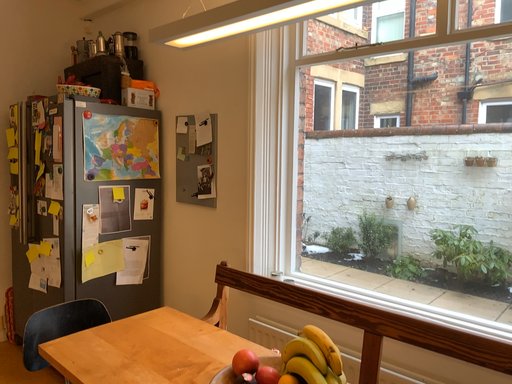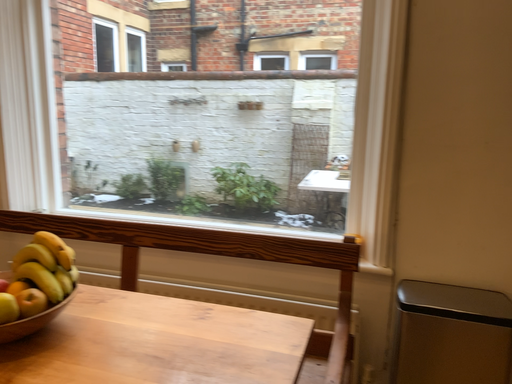
Question: Which way did the camera rotate in the video?

Choices:
 (A) rotated left
 (B) rotated right

Answer: (B)